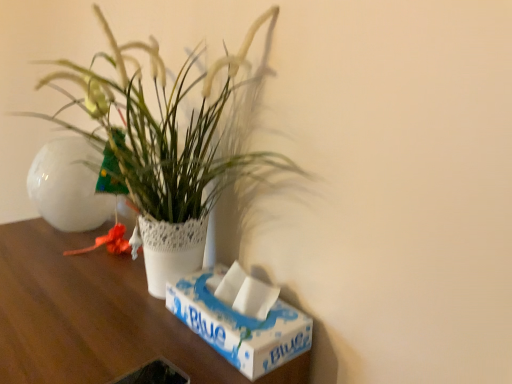
Identify the location of free spot above wooden table at center (from a real-world perspective). (82, 295).